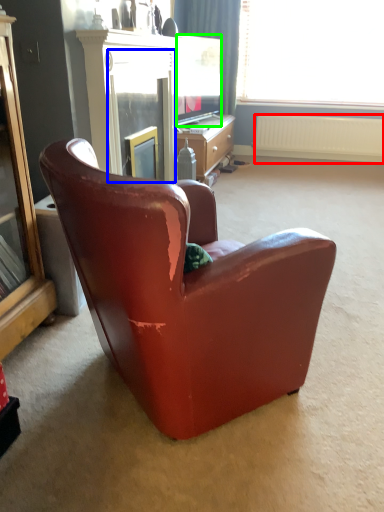
Question: Which is farther away from radiator (highlighted by a red box)? screen door (highlighted by a blue box) or television (highlighted by a green box)?

Choices:
 (A) screen door
 (B) television

Answer: (A)